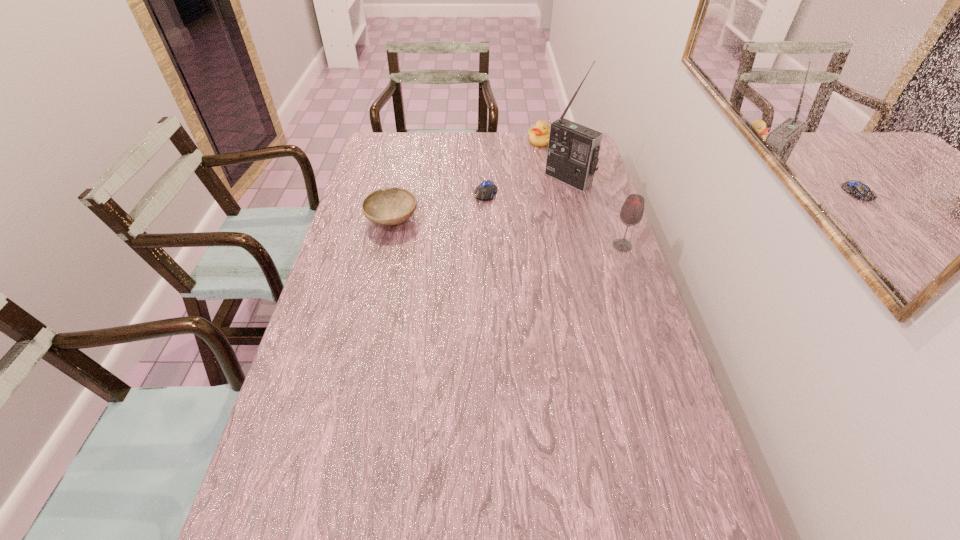
Where is `free location located on the back of the nearest object`? Image resolution: width=960 pixels, height=540 pixels. free location located on the back of the nearest object is located at coordinates (599, 176).

The height and width of the screenshot is (540, 960). Identify the location of vacant area located 0.320m on the display of the tallest object. (497, 231).

Locate an element on the screen. vacant area situated on the display of the tallest object is located at coordinates (515, 218).

Find the location of a particular element. This screenshot has height=540, width=960. free space located on the display of the tallest object is located at coordinates (501, 227).

The width and height of the screenshot is (960, 540). Identify the location of free location located 0.330m on the front-facing side of the third tallest object. (518, 192).

What are the coordinates of `vacant area situated on the front-facing side of the third tallest object` in the screenshot? It's located at 532,161.

This screenshot has height=540, width=960. Find the location of `free region located on the front-facing side of the third tallest object`. free region located on the front-facing side of the third tallest object is located at coordinates (527, 173).

Locate an element on the screen. Image resolution: width=960 pixels, height=540 pixels. free space located on the button side of the fourth object from right to left is located at coordinates (454, 278).

Locate an element on the screen. This screenshot has height=540, width=960. vacant point located 0.260m on the button side of the fourth object from right to left is located at coordinates (465, 251).

Locate an element on the screen. The width and height of the screenshot is (960, 540). free space located 0.160m on the button side of the fourth object from right to left is located at coordinates (472, 231).